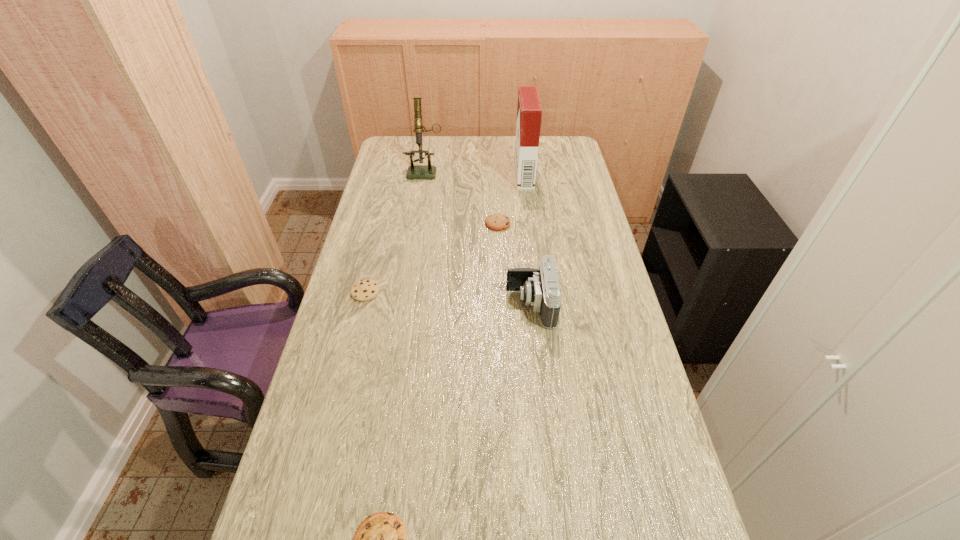
Find the location of a particular element. free space located at the eyepiece of the microscope is located at coordinates (421, 194).

You are a GUI agent. You are given a task and a screenshot of the screen. Output one action in this format:
    pyautogui.click(x=<x>, y=<y>)
    Task: Click on the free region located 0.120m at the front of the fourth shortest object with an open lens cover
    
    Given the screenshot: What is the action you would take?
    pyautogui.click(x=466, y=305)

Where is `free space located 0.160m at the front of the fourth shortest object with an open lens cover`? The width and height of the screenshot is (960, 540). free space located 0.160m at the front of the fourth shortest object with an open lens cover is located at coordinates (452, 305).

Image resolution: width=960 pixels, height=540 pixels. Identify the location of vacant space located 0.390m at the front of the fourth shortest object with an open lens cover. (373, 305).

Locate an element on the screen. Image resolution: width=960 pixels, height=540 pixels. free spot located 0.280m on the front of the leftmost cookie is located at coordinates (343, 386).

You are a GUI agent. You are given a task and a screenshot of the screen. Output one action in this format:
    pyautogui.click(x=<x>, y=<y>)
    Task: Click on the vacant space located on the left of the farthest cookie
    
    Given the screenshot: What is the action you would take?
    pyautogui.click(x=418, y=224)

Locate an element on the screen. The width and height of the screenshot is (960, 540). cigarette_case that is at the far edge is located at coordinates (529, 111).

The height and width of the screenshot is (540, 960). I want to click on microscope present at the far edge, so click(428, 171).

Where is `microscope that is at the left edge`? This screenshot has height=540, width=960. microscope that is at the left edge is located at coordinates (428, 171).

At what (x,y) coordinates should I click in order to perform the action: click on cookie present at the left edge. Please return your answer as a coordinate pair (x, y). The width and height of the screenshot is (960, 540). Looking at the image, I should click on (364, 290).